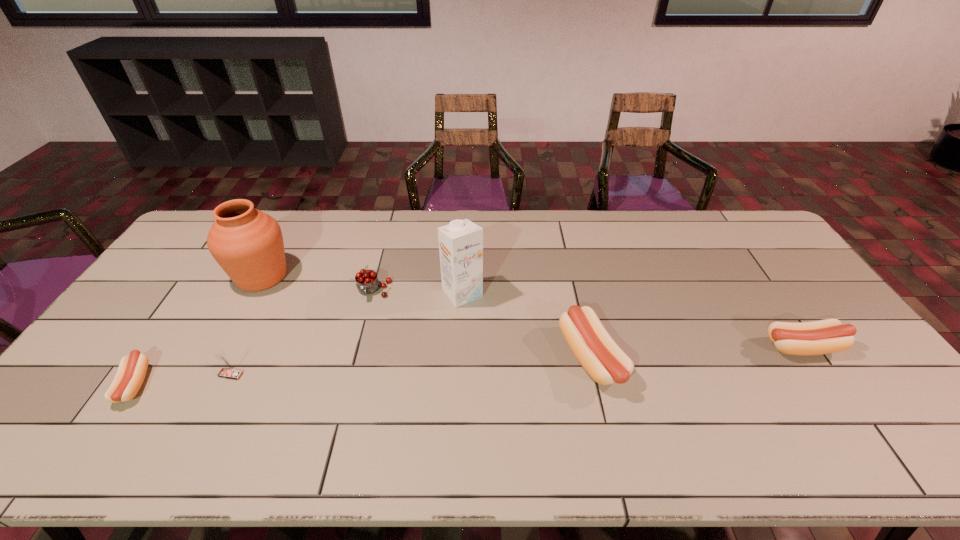
Identify the location of empty space that is in between the leftmost object and the second shortest object. The image size is (960, 540). (468, 366).

At what (x,y) coordinates should I click in order to perform the action: click on vacant area that lies between the urn and the matchbox. Please return your answer as a coordinate pair (x, y). The image size is (960, 540). Looking at the image, I should click on (247, 325).

Find the location of `vacant space that's between the sixth object from left to right and the leftmost object`. vacant space that's between the sixth object from left to right and the leftmost object is located at coordinates (363, 371).

You are a GUI agent. You are given a task and a screenshot of the screen. Output one action in this format:
    pyautogui.click(x=<x>, y=<y>)
    Task: Click on the fifth closest object to the fourth object from left to right
    The width and height of the screenshot is (960, 540).
    Given the screenshot: What is the action you would take?
    pyautogui.click(x=132, y=369)

Where is `object that is the third closest to the urn`? Image resolution: width=960 pixels, height=540 pixels. object that is the third closest to the urn is located at coordinates (228, 371).

Identify the location of sausage that is the closest to the matchbox. The height and width of the screenshot is (540, 960). (132, 369).

Image resolution: width=960 pixels, height=540 pixels. I want to click on sausage that stands as the second closest to the shortest object, so click(826, 336).

In order to click on free spot that satisfies the following two spatial constraints: 1. on the back side of the second sausage from left to right; 2. on the right side of the matchbox in this screenshot , I will do `click(239, 359)`.

Where is `vacant region that satisfies the following two spatial constraints: 1. on the back side of the sixth object from left to right; 2. on the right side of the second tallest sausage`? The width and height of the screenshot is (960, 540). vacant region that satisfies the following two spatial constraints: 1. on the back side of the sixth object from left to right; 2. on the right side of the second tallest sausage is located at coordinates (588, 347).